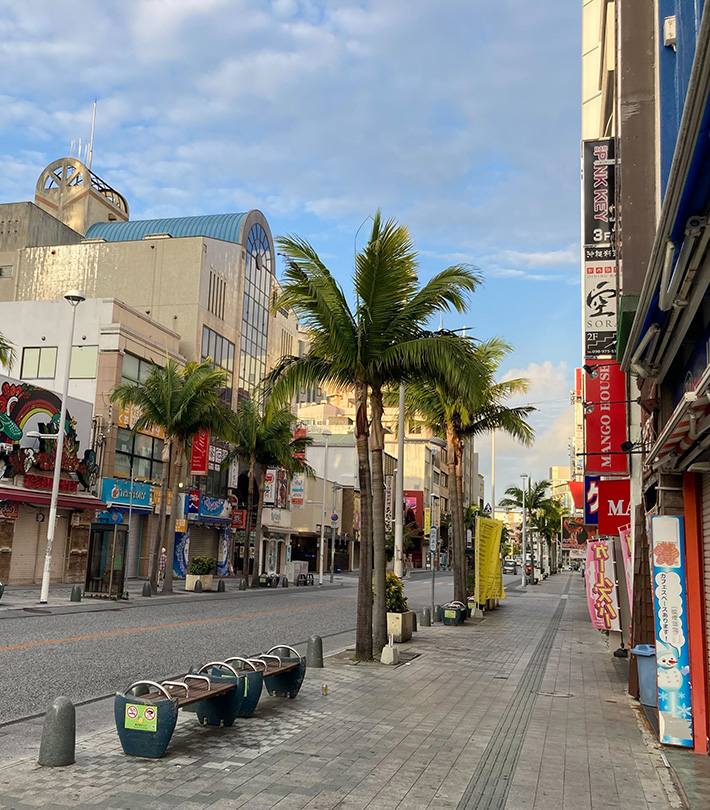
Find the location of a particular element. This screenshot has width=710, height=810. bench is located at coordinates (209, 683), (273, 667), (454, 599).